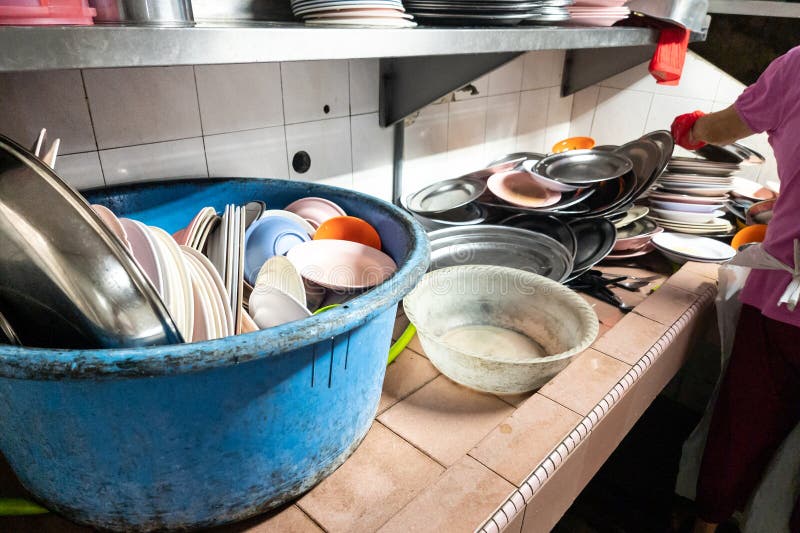
I want to click on stainless steel shelf, so click(x=132, y=42), click(x=546, y=42).